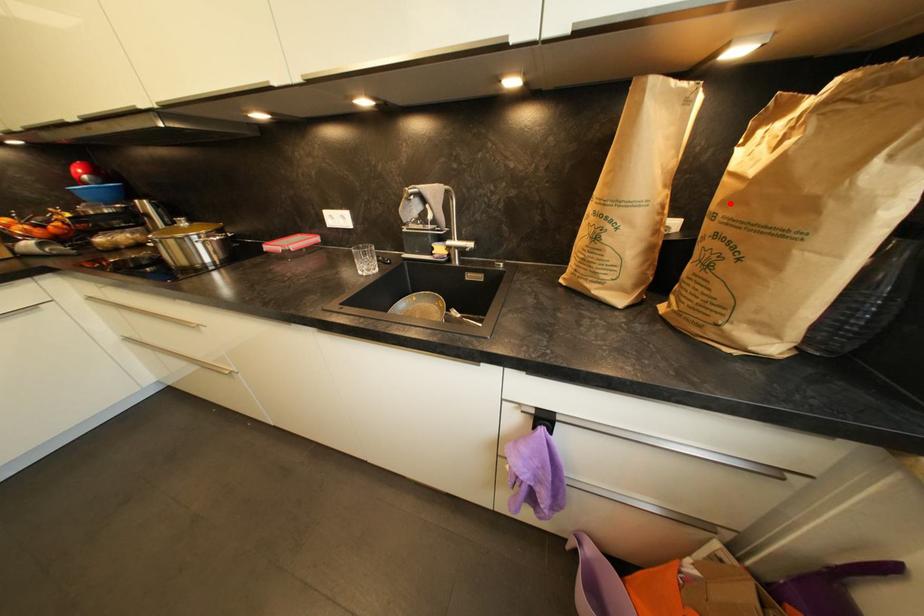
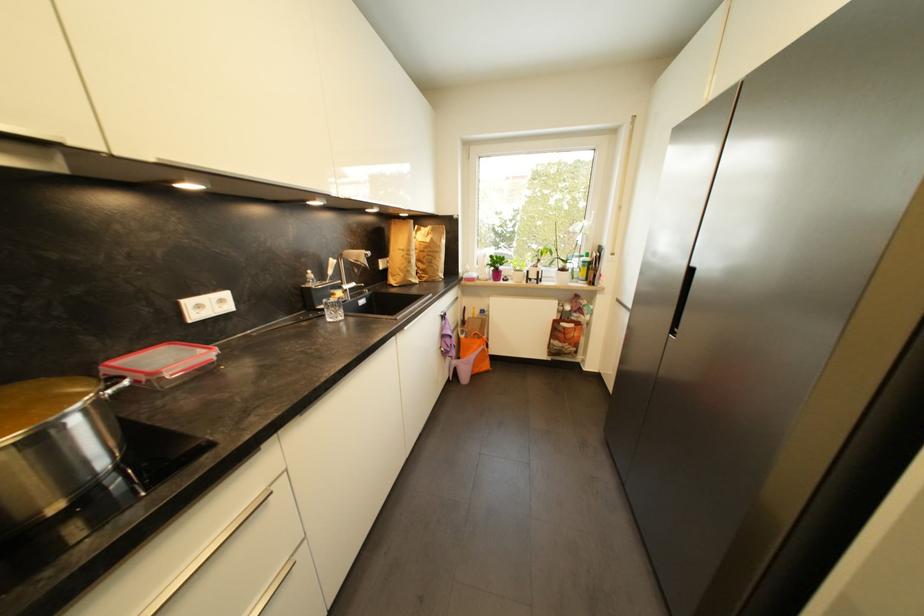
Question: I am providing you with two images of the same scene from different viewpoints. Image1 has a red point marked. In image2, the corresponding 3D location appears at what relative position? Reply with the corresponding letter.

Choices:
 (A) Closer
 (B) Farther

Answer: (A)